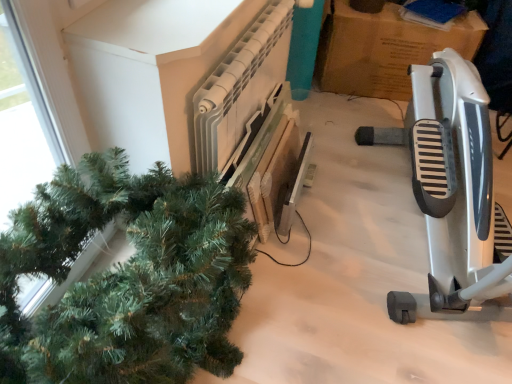
Question: Is silver metallic exercise bike at right wider or thinner than green matte christmas tree at left?

Choices:
 (A) wide
 (B) thin

Answer: (A)

Question: Visually, is silver metallic exercise bike at right positioned to the left or to the right of green matte christmas tree at left?

Choices:
 (A) left
 (B) right

Answer: (B)

Question: Based on their relative distances, which object is farther from the silver metallic exercise bike at right?

Choices:
 (A) white plastic radiator at upper center
 (B) cardboard at upper right
 (C) green matte christmas tree at left

Answer: (C)

Question: Estimate the real-world distances between objects in this image. Which object is farther from the white plastic radiator at upper center?

Choices:
 (A) silver metallic exercise bike at right
 (B) green matte christmas tree at left
 (C) cardboard at upper right

Answer: (C)